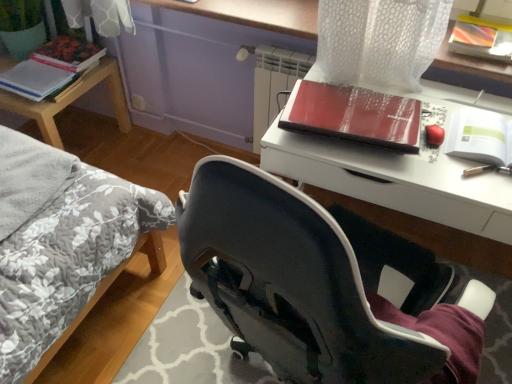
Find the location of a particular element. This screenshot has height=384, width=512. vacant space that's between shiny red book at upper right and green matte paperback book at upper right, the 3th paperback book positioned from the back is located at coordinates (445, 144).